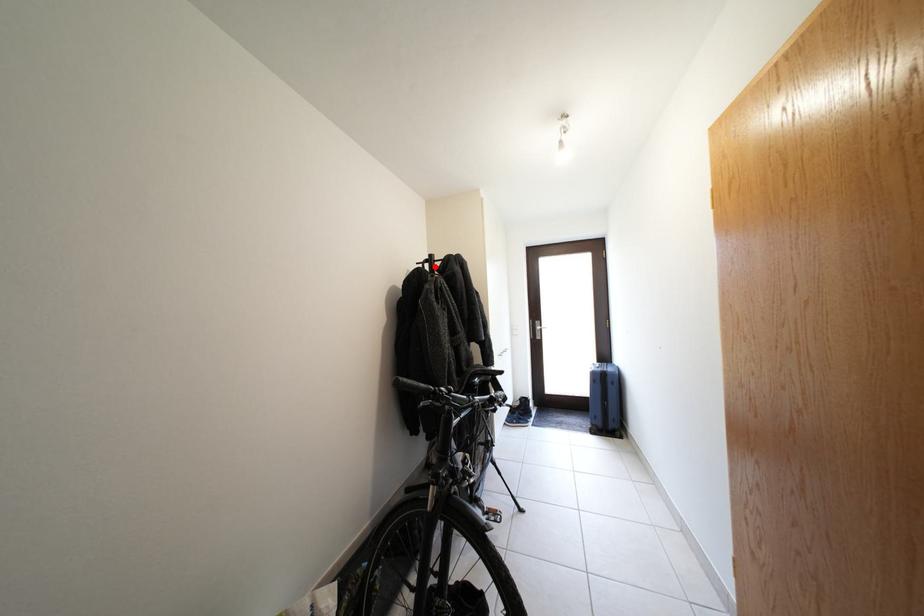
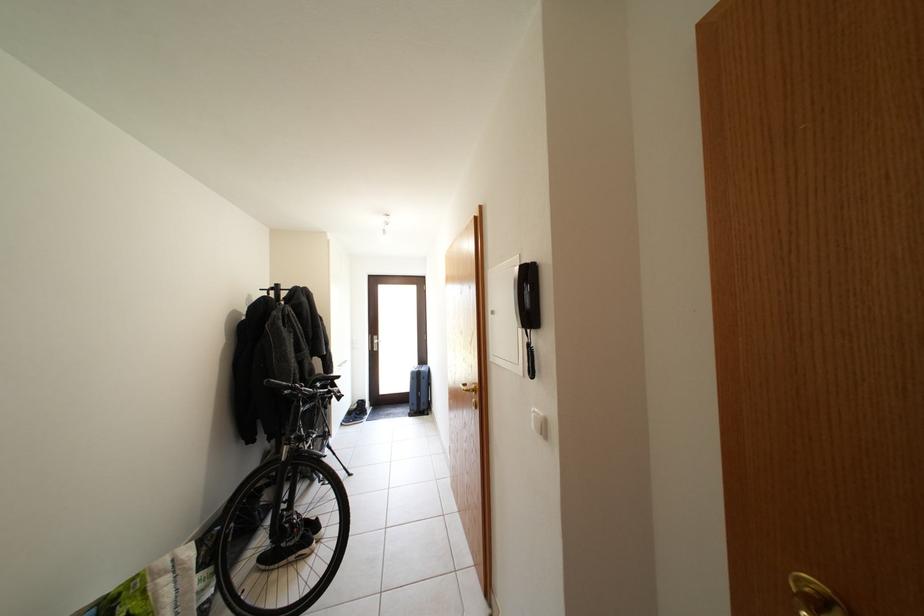
Find the pixel in the second image that matches the highlighted location in the first image.

(281, 294)